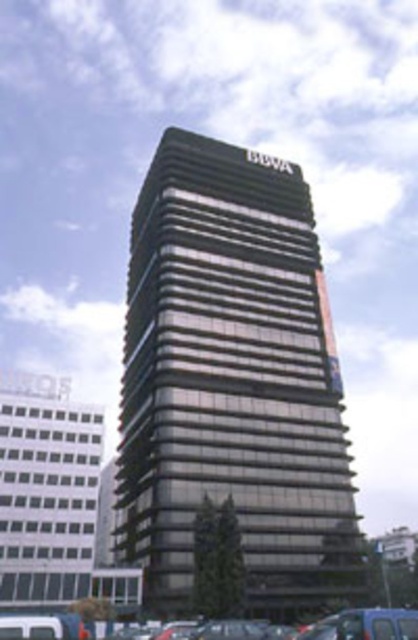
Question: Does metallic glass tower at center have a larger size compared to metallic gray cars at lower center?

Choices:
 (A) yes
 (B) no

Answer: (B)

Question: Which of the following is the closest to the observer?

Choices:
 (A) metallic gray cars at lower center
 (B) metallic glass tower at center

Answer: (A)

Question: Can you confirm if metallic glass tower at center is smaller than metallic gray cars at lower center?

Choices:
 (A) yes
 (B) no

Answer: (A)

Question: Which of the following is the farthest from the observer?

Choices:
 (A) metallic gray cars at lower center
 (B) metallic glass tower at center

Answer: (B)

Question: Is metallic glass tower at center closer to the viewer compared to metallic gray cars at lower center?

Choices:
 (A) no
 (B) yes

Answer: (A)